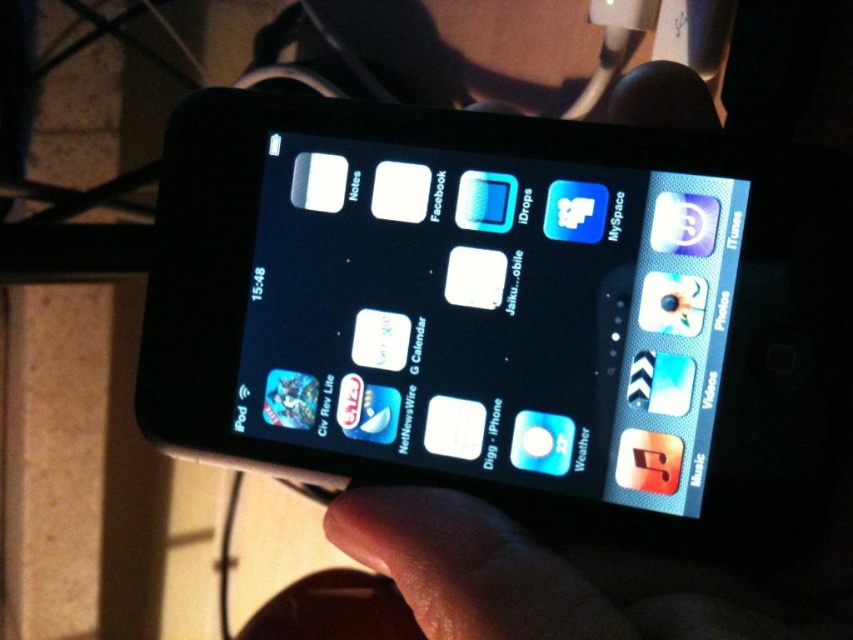
Question: Which object is closer to the camera taking this photo?

Choices:
 (A) black plastic smartphone at center
 (B) black matte hand at center

Answer: (B)

Question: Does black plastic smartphone at center appear under black matte hand at center?

Choices:
 (A) no
 (B) yes

Answer: (A)

Question: Which object is closer to the camera taking this photo?

Choices:
 (A) black matte hand at center
 (B) black plastic smartphone at center

Answer: (A)

Question: Is black plastic smartphone at center to the left of black matte hand at center from the viewer's perspective?

Choices:
 (A) no
 (B) yes

Answer: (B)

Question: Which of the following is the closest to the observer?

Choices:
 (A) black matte hand at center
 (B) black plastic smartphone at center

Answer: (A)

Question: In this image, where is black plastic smartphone at center located relative to black matte hand at center?

Choices:
 (A) above
 (B) below

Answer: (A)